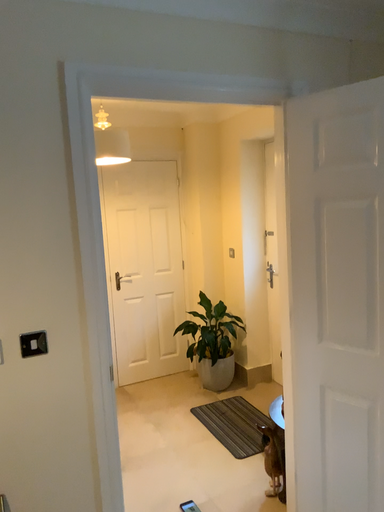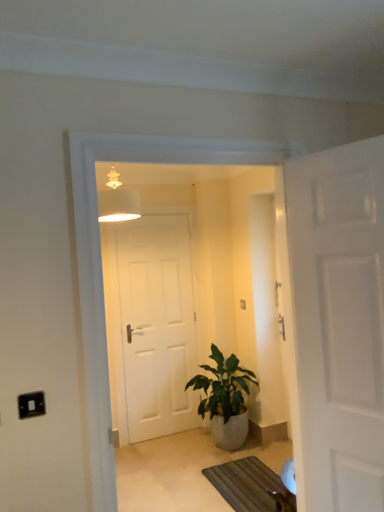
Question: Which way did the camera rotate in the video?

Choices:
 (A) rotated downward
 (B) rotated upward

Answer: (B)